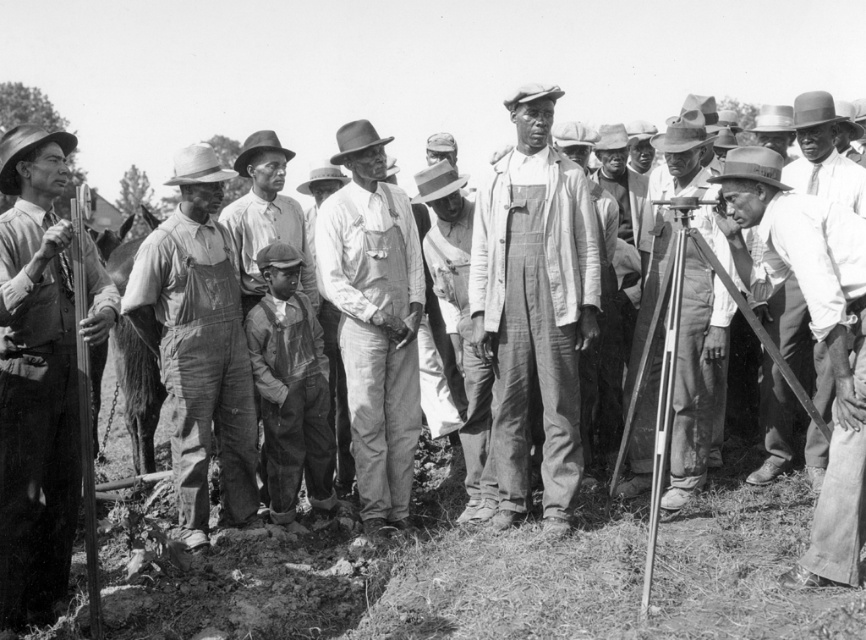
Question: Which object is closer to the camera taking this photo?

Choices:
 (A) smooth wood tripod at center
 (B) matte gray overalls at center
 (C) metallic tripod at center right

Answer: (C)

Question: Can you confirm if smooth leather hat at center is bigger than smooth wood pole at left?

Choices:
 (A) no
 (B) yes

Answer: (A)

Question: Which of the following is the closest to the observer?

Choices:
 (A) (712, 264)
 (B) (173, 474)
 (C) (695, 266)

Answer: (A)

Question: Can you confirm if matte gray overalls at center is positioned below matte overalls at center?

Choices:
 (A) no
 (B) yes

Answer: (A)

Question: Which object appears closest to the camera in this image?

Choices:
 (A) rough denim overalls at center
 (B) smooth wood pole at left
 (C) matte gray overalls at center
 (D) metallic tripod at center right

Answer: (B)

Question: Is metallic tripod at center right smaller than matte brown overalls at center?

Choices:
 (A) yes
 (B) no

Answer: (B)